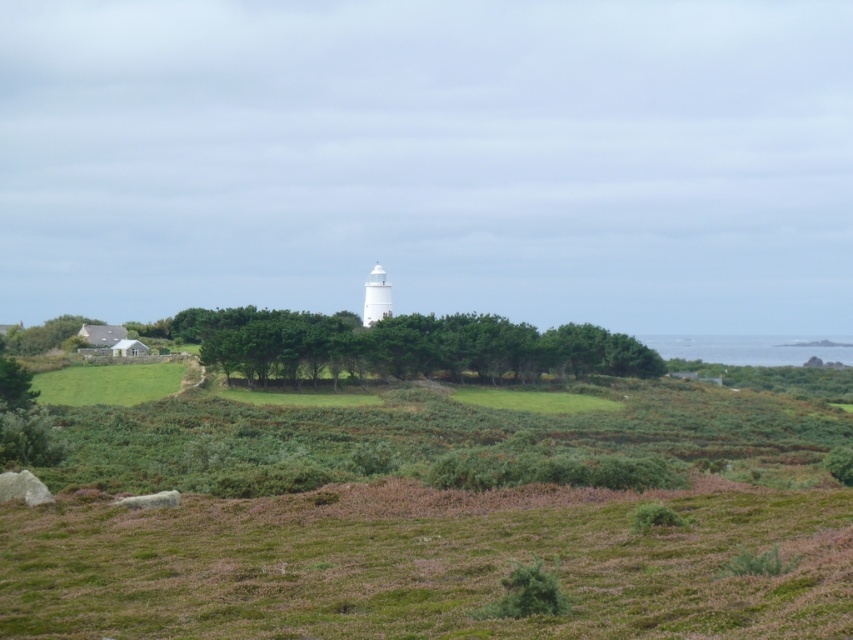
Question: Can you confirm if green grassy field at lower left is smaller than green leafy tree at lower left?

Choices:
 (A) yes
 (B) no

Answer: (A)

Question: Does green grassy field at lower left appear on the right side of green leafy tree at lower left?

Choices:
 (A) yes
 (B) no

Answer: (A)

Question: Does green grassy field at lower left have a larger size compared to green leafy tree at lower left?

Choices:
 (A) yes
 (B) no

Answer: (B)

Question: Which point is farther to the camera?

Choices:
 (A) (442, 364)
 (B) (39, 340)
 (C) (73, 394)

Answer: (B)

Question: Among these objects, which one is nearest to the camera?

Choices:
 (A) green leafy tree at lower left
 (B) green leafy trees at center
 (C) green grassy field at lower left

Answer: (C)

Question: Which object appears farthest from the camera in this image?

Choices:
 (A) green leafy trees at center
 (B) green leafy tree at lower left
 (C) green grassy field at lower left

Answer: (B)